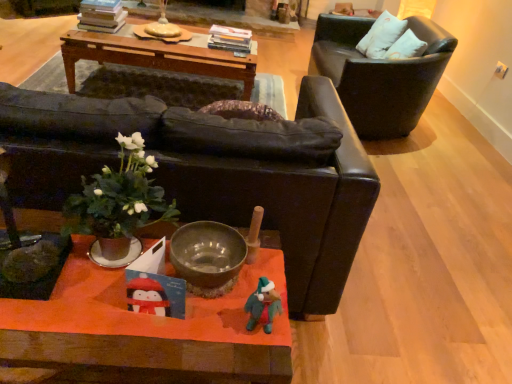
Question: Is there a large distance between white fabric pillow at upper right and green leafy plant at center?

Choices:
 (A) yes
 (B) no

Answer: (A)

Question: From a real-world perspective, is white fabric pillow at upper right on green leafy plant at center?

Choices:
 (A) yes
 (B) no

Answer: (B)

Question: From a real-world perspective, does white fabric pillow at upper right sit lower than green leafy plant at center?

Choices:
 (A) yes
 (B) no

Answer: (A)

Question: Is green leafy plant at center a part of white fabric pillow at upper right?

Choices:
 (A) no
 (B) yes

Answer: (A)

Question: Can you confirm if white fabric pillow at upper right is smaller than green leafy plant at center?

Choices:
 (A) no
 (B) yes

Answer: (A)

Question: Is white fabric pillow at upper right facing away from green leafy plant at center?

Choices:
 (A) yes
 (B) no

Answer: (B)

Question: Is black leather chair at upper right, positioned as the first chair in back-to-front order, located outside felt-like green toy at lower center?

Choices:
 (A) no
 (B) yes

Answer: (B)

Question: Does black leather chair at upper right, the 1th chair viewed from the right, appear on the right side of felt-like green toy at lower center?

Choices:
 (A) yes
 (B) no

Answer: (A)

Question: From a real-world perspective, does black leather chair at upper right, acting as the second chair starting from the front, stand above felt-like green toy at lower center?

Choices:
 (A) no
 (B) yes

Answer: (A)

Question: Is black leather chair at upper right, placed as the 2th chair when sorted from left to right, oriented away from felt-like green toy at lower center?

Choices:
 (A) no
 (B) yes

Answer: (A)

Question: Can you confirm if black leather chair at upper right, the 1th chair viewed from the right, is taller than felt-like green toy at lower center?

Choices:
 (A) yes
 (B) no

Answer: (A)

Question: Could you tell me if black leather chair at upper right, acting as the second chair starting from the front, is turned towards felt-like green toy at lower center?

Choices:
 (A) no
 (B) yes

Answer: (A)

Question: Is wooden orange coffee table at center bigger than black leather chair at upper right, placed as the 2th chair when sorted from left to right?

Choices:
 (A) yes
 (B) no

Answer: (B)